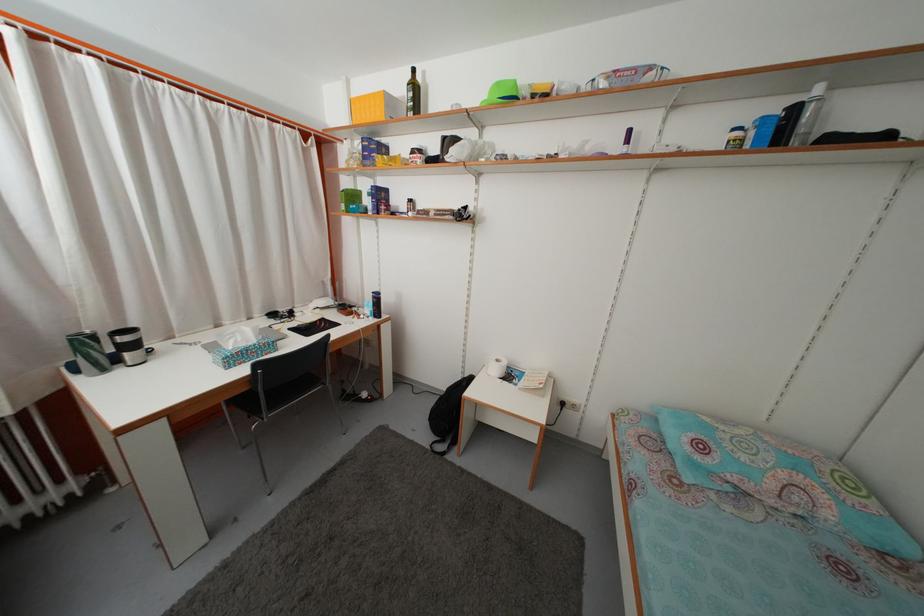
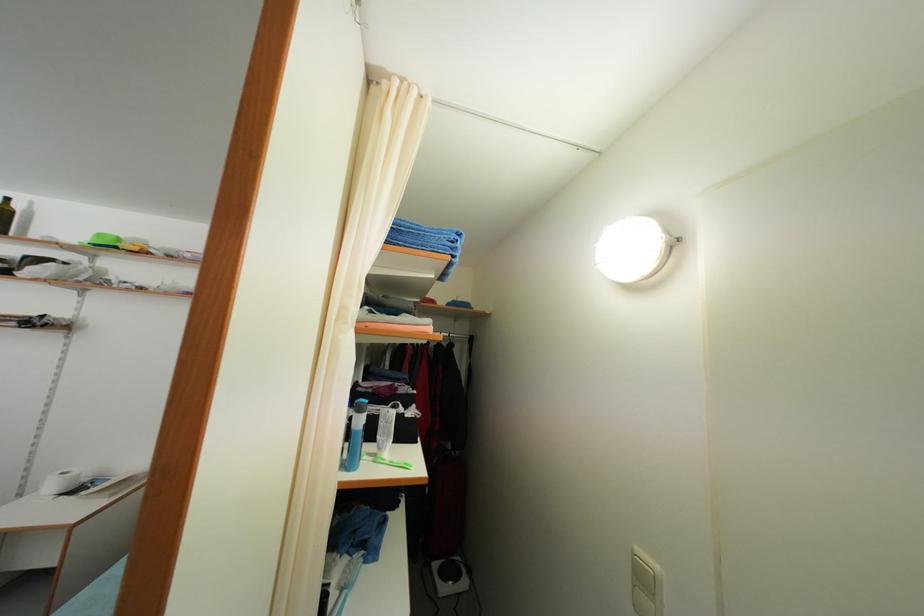
Find the pixel in the second image that matches pixel 504 92 in the first image.

(104, 243)